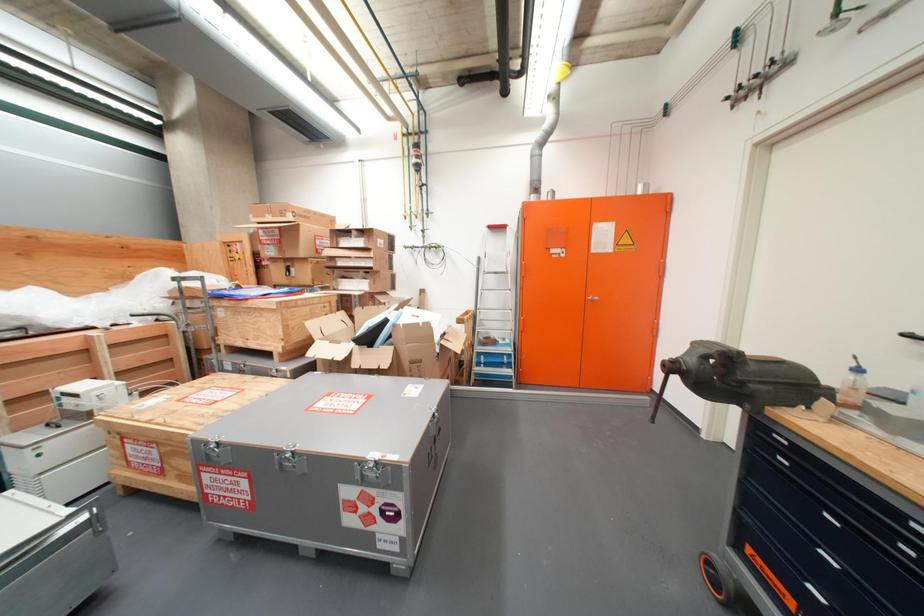
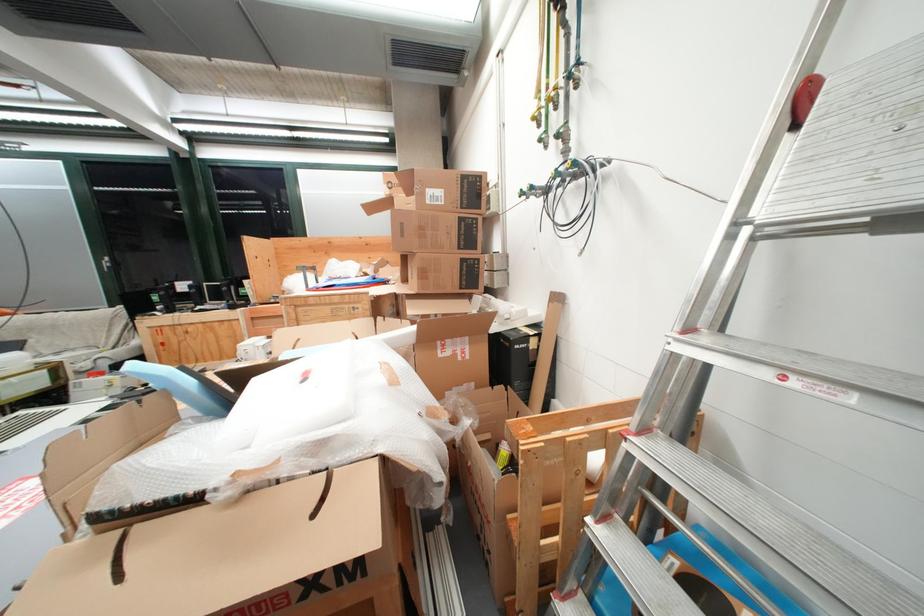
Locate, in the second image, the point that corresponds to (x=301, y=219) in the first image.

(398, 192)